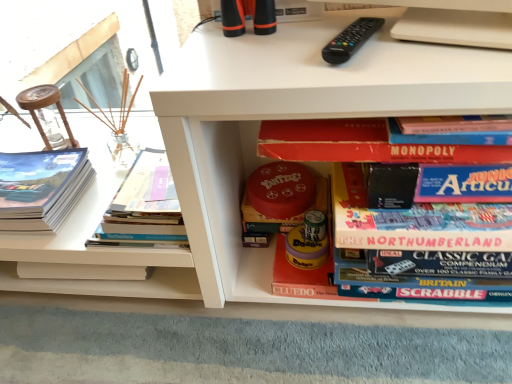
The width and height of the screenshot is (512, 384). Find the location of `free space to the left of black plastic remote at upper center`. free space to the left of black plastic remote at upper center is located at coordinates pos(251,57).